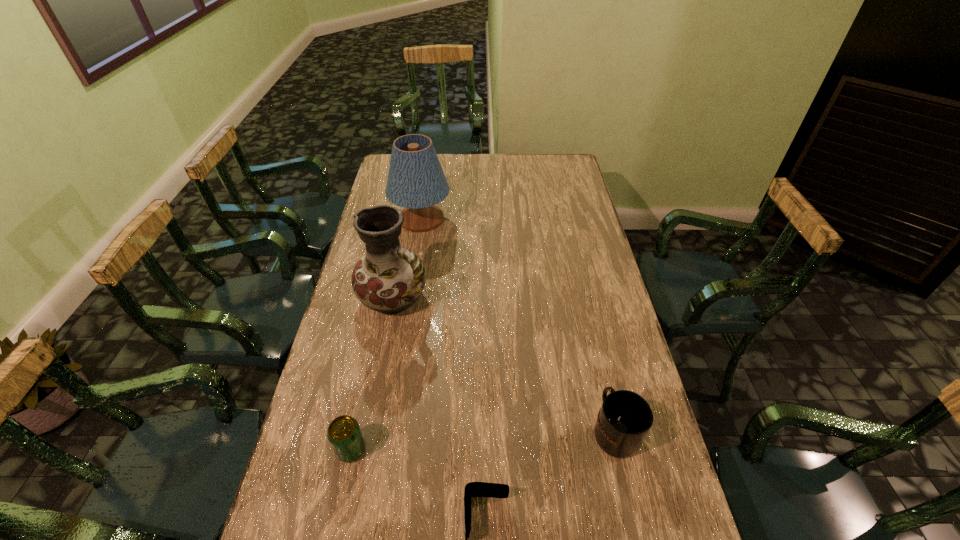
Where is `the farthest object`? The width and height of the screenshot is (960, 540). the farthest object is located at coordinates (416, 181).

In order to click on the fourth nearest object in this screenshot , I will do `click(389, 279)`.

Find the location of a particular element. the rightmost object is located at coordinates (625, 418).

The image size is (960, 540). What are the coordinates of `beer can` in the screenshot? It's located at (344, 434).

Locate an element on the screen. free space located 0.050m on the left of the farthest object is located at coordinates (378, 219).

Locate an element on the screen. vacant space located on the front of the second farthest object is located at coordinates (372, 420).

Locate an element on the screen. Image resolution: width=960 pixels, height=540 pixels. vacant area located 0.360m with the handle on the side of the rightmost object is located at coordinates (586, 306).

The image size is (960, 540). In order to click on vacant space positioned 0.210m with the handle on the side of the rightmost object in this screenshot , I will do `click(594, 342)`.

You are a GUI agent. You are given a task and a screenshot of the screen. Output one action in this format:
    pyautogui.click(x=<x>, y=<y>)
    Task: Click on the vacant space located with the handle on the side of the rightmost object
    The height and width of the screenshot is (540, 960).
    Given the screenshot: What is the action you would take?
    pyautogui.click(x=601, y=373)

At what (x,y) coordinates should I click in order to perform the action: click on vacant space positioned 0.260m on the right of the beer can. Please return your answer as a coordinate pair (x, y). This screenshot has height=540, width=960. Looking at the image, I should click on (468, 450).